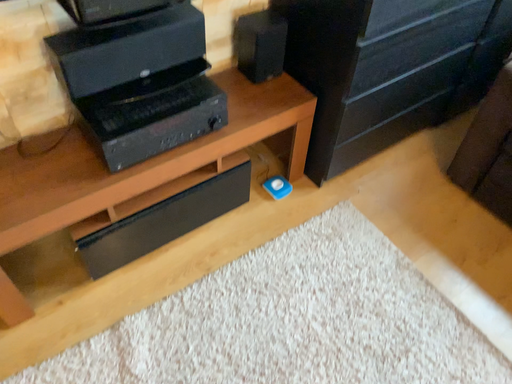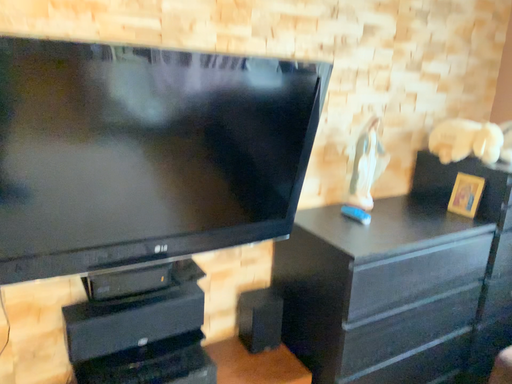
Question: How did the camera likely rotate when shooting the video?

Choices:
 (A) rotated downward
 (B) rotated upward

Answer: (B)